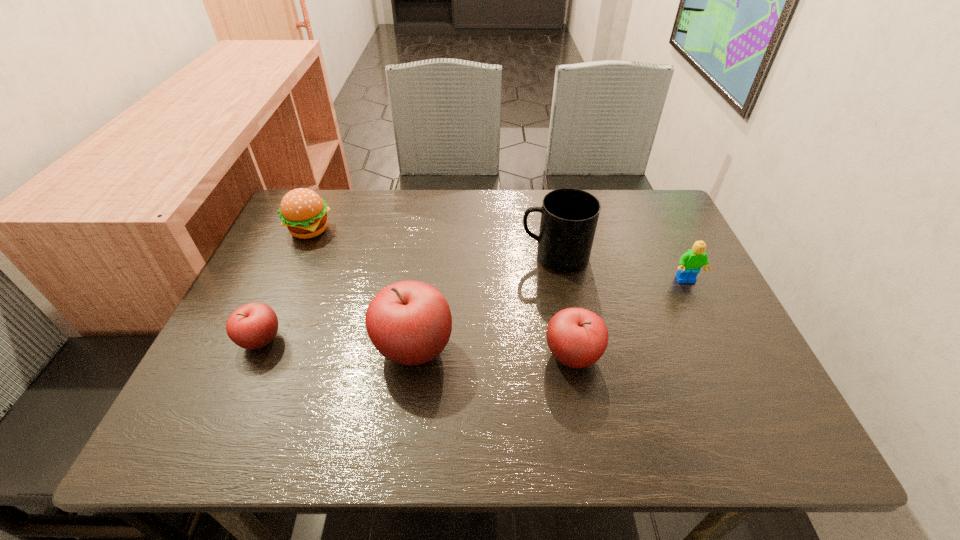
Locate an element on the screen. The image size is (960, 540). the shortest object is located at coordinates (252, 326).

At what (x,y) coordinates should I click in order to perform the action: click on the leftmost apple. Please return your answer as a coordinate pair (x, y). This screenshot has height=540, width=960. Looking at the image, I should click on (252, 326).

Identify the location of the tallest apple. (409, 322).

Where is `the third object from left to right`? the third object from left to right is located at coordinates (409, 322).

This screenshot has width=960, height=540. In order to click on the second shortest apple in this screenshot , I will do `click(577, 338)`.

The image size is (960, 540). What are the coordinates of `hamburger` in the screenshot? It's located at (303, 211).

Locate an element on the screen. mug is located at coordinates (569, 216).

This screenshot has height=540, width=960. I want to click on the fourth nearest object, so click(x=690, y=262).

This screenshot has height=540, width=960. In order to click on the rightmost object in this screenshot , I will do `click(690, 262)`.

At what (x,y) coordinates should I click in order to perform the action: click on vacant region located on the back of the shortest object. Please return your answer as a coordinate pair (x, y). Looking at the image, I should click on (315, 220).